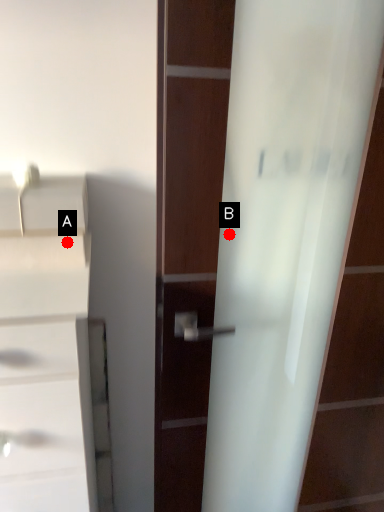
Question: Two points are circled on the image, labeled by A and B beside each circle. Among these points, which one is farthest from the camera?

Choices:
 (A) A is further
 (B) B is further

Answer: (B)